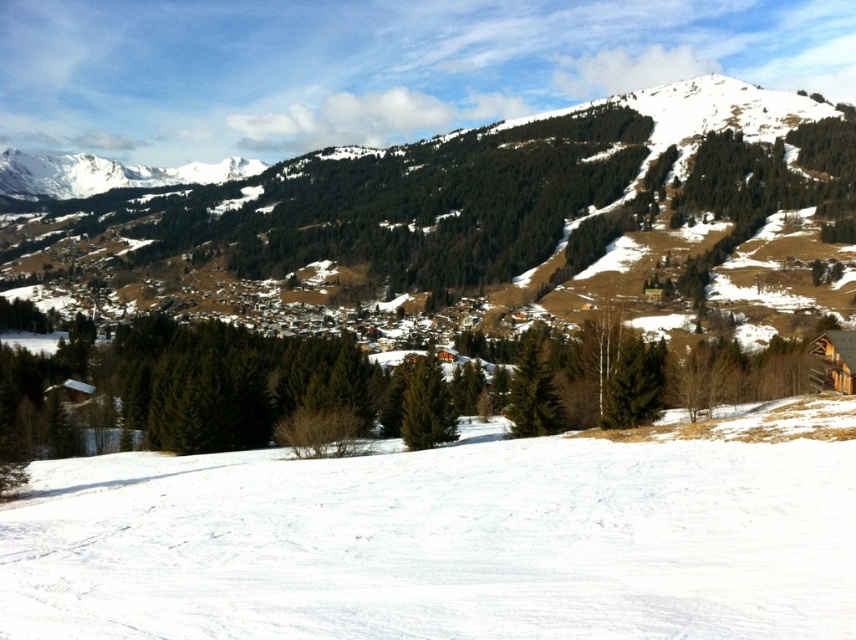
Is white snow ski slope at lower center to the right of snowy forested mountain at center from the viewer's perspective?

Correct, you'll find white snow ski slope at lower center to the right of snowy forested mountain at center.

From the picture: Does white snow ski slope at lower center appear on the left side of snowy forested mountain at center?

Incorrect, white snow ski slope at lower center is not on the left side of snowy forested mountain at center.

Is point (443, 628) closer to viewer compared to point (544, 316)?

Yes, it is.

Identify the location of white snow ski slope at lower center. The height and width of the screenshot is (640, 856). (449, 540).